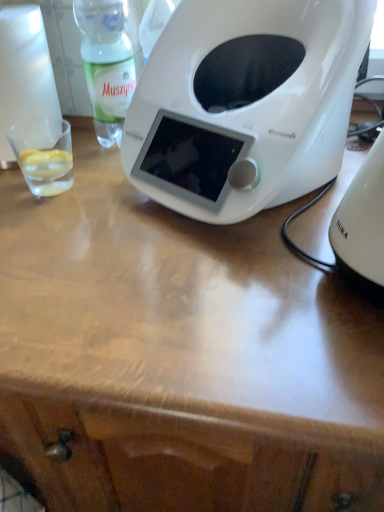
Image resolution: width=384 pixels, height=512 pixels. Identify the location of vacant space in front of white plastic toaster at center. (214, 286).